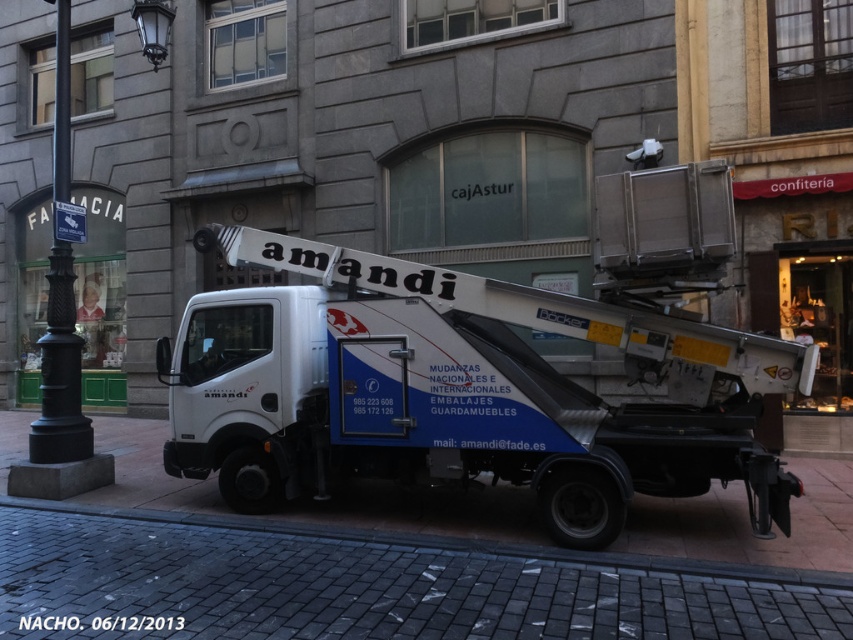
You are a delivery person trying to park your van in the street. You notice the gray cobblestone pavement at center and the black cast iron pole at left. Which object is shorter in height?

The gray cobblestone pavement at center is not as tall as the black cast iron pole at left, so the gray cobblestone pavement at center is shorter in height.

You are a delivery person trying to park your van on the gray cobblestone pavement at center. The white metallic truck at center is currently blocking the path. Can you drive around it to access the pavement?

The white metallic truck at center is positioned over gray cobblestone pavement at center, so you cannot drive around it as it is already occupying the pavement.

You are standing at the center of the street and want to take a photo of the white and blue utility truck with the black metal lamp post at left in the background. Where should you position yourself to ensure the lamp post is fully visible in the frame?

To ensure the black metal lamp post at left is fully visible in the frame, position yourself at the center of the street facing the truck, as the lamp post is located at coordinates point [61,337], which places it within the background view.